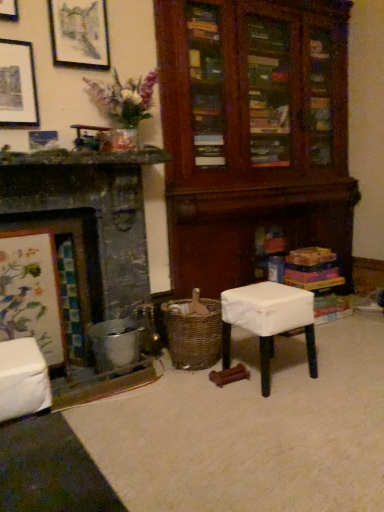
Question: Is metallic silver fireplace at left not close to matte black picture frame at upper left, marked as the 2th picture frame in a bottom-to-top arrangement?

Choices:
 (A) no
 (B) yes

Answer: (A)

Question: Is metallic silver fireplace at left outside of matte black picture frame at upper left, the 2th picture frame when ordered from top to bottom?

Choices:
 (A) yes
 (B) no

Answer: (A)

Question: Can you confirm if metallic silver fireplace at left is wider than matte black picture frame at upper left, the 2th picture frame when ordered from top to bottom?

Choices:
 (A) yes
 (B) no

Answer: (A)

Question: Does metallic silver fireplace at left come behind matte black picture frame at upper left, the 2th picture frame when ordered from top to bottom?

Choices:
 (A) yes
 (B) no

Answer: (B)

Question: Does metallic silver fireplace at left have a lesser width compared to matte black picture frame at upper left, marked as the 2th picture frame in a bottom-to-top arrangement?

Choices:
 (A) yes
 (B) no

Answer: (B)

Question: From the image's perspective, is metallic silver fireplace at left located above matte black picture frame at upper left, marked as the 2th picture frame in a bottom-to-top arrangement?

Choices:
 (A) no
 (B) yes

Answer: (A)

Question: From the image's perspective, is woven brown basket at lower center under metallic silver fireplace at left?

Choices:
 (A) yes
 (B) no

Answer: (A)

Question: Is metallic silver fireplace at left at the back of woven brown basket at lower center?

Choices:
 (A) no
 (B) yes

Answer: (A)

Question: Can you confirm if woven brown basket at lower center is taller than metallic silver fireplace at left?

Choices:
 (A) yes
 (B) no

Answer: (B)

Question: From a real-world perspective, is woven brown basket at lower center physically above metallic silver fireplace at left?

Choices:
 (A) no
 (B) yes

Answer: (A)

Question: Is woven brown basket at lower center bigger than metallic silver fireplace at left?

Choices:
 (A) yes
 (B) no

Answer: (B)

Question: Is woven brown basket at lower center positioned beyond the bounds of metallic silver fireplace at left?

Choices:
 (A) yes
 (B) no

Answer: (A)

Question: From a real-world perspective, is metallic silver picture frame at upper left, which is the first picture frame from bottom to top, positioned over matte black picture frame at upper left, the 2th picture frame when ordered from top to bottom, based on gravity?

Choices:
 (A) no
 (B) yes

Answer: (A)